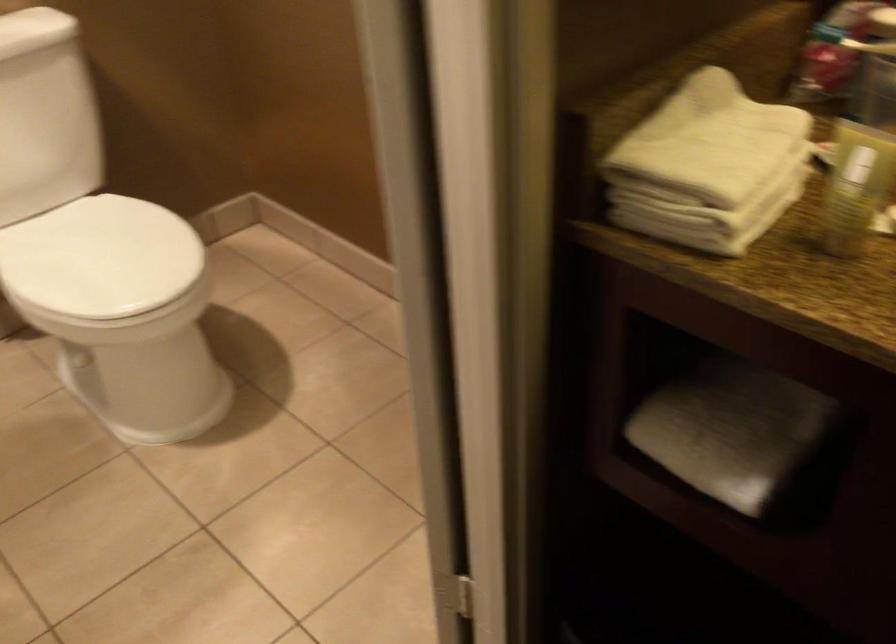
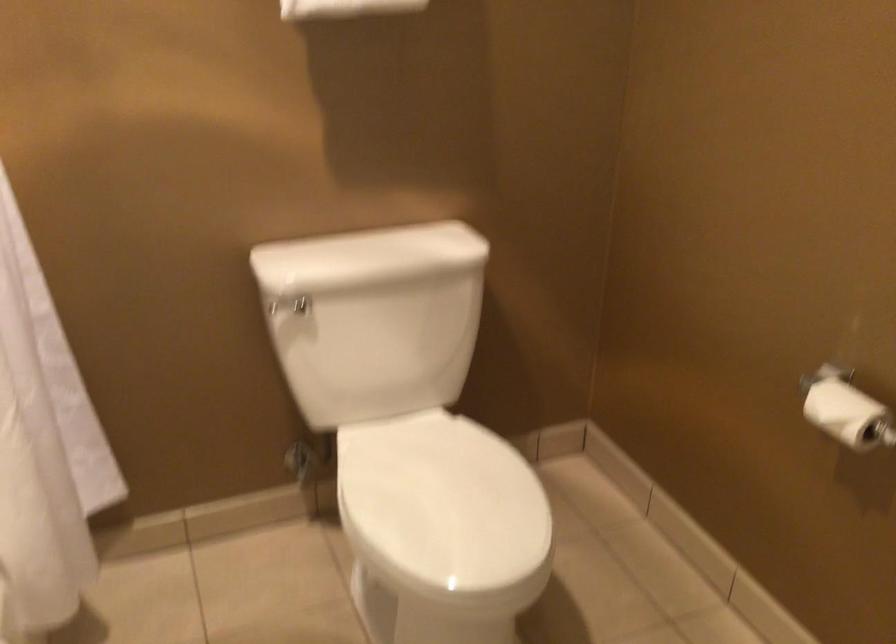
Where in the second image is the point corresponding to the point at 99,257 from the first image?

(442, 505)